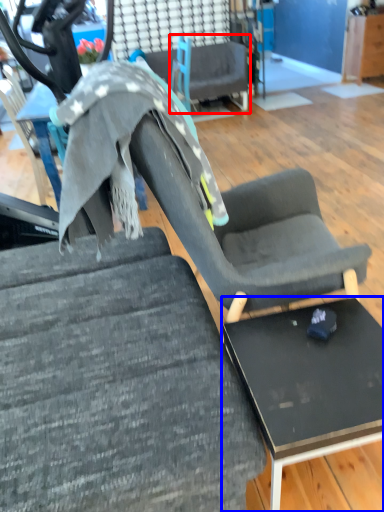
Question: Which point is further to the camera, chair (highlighted by a red box) or table (highlighted by a blue box)?

Choices:
 (A) chair
 (B) table

Answer: (A)